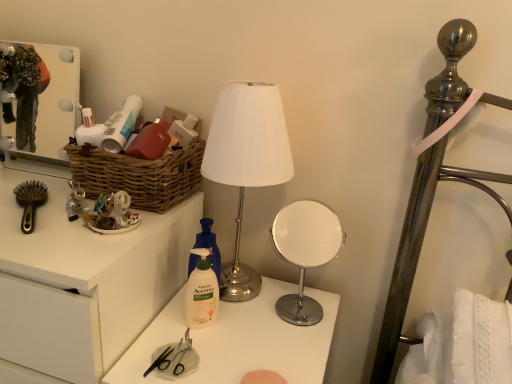
Find the location of a particular element. The width and height of the screenshot is (512, 384). blank space situated above matte plastic scissors at center (from a real-world perspective) is located at coordinates (239, 337).